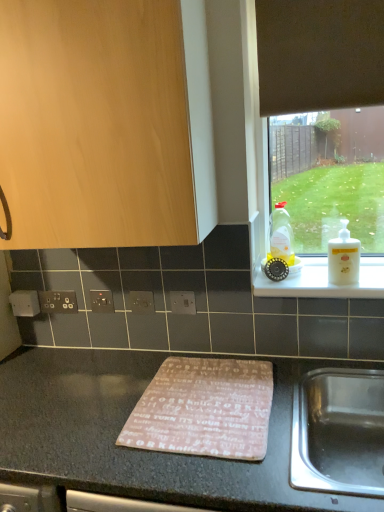
Find the location of a particular element. matte gray electric outlet at center, the 1th electric outlet viewed from the right is located at coordinates (183, 302).

I want to click on wooden cabinet at upper left, so click(106, 123).

What do you see at coordinates (281, 234) in the screenshot?
I see `translucent plastic bottle at right, which is the 2th bottle from front to back` at bounding box center [281, 234].

Where is `white glossy lotion at right, marked as the 1th bottle in a right-to-left arrangement`? white glossy lotion at right, marked as the 1th bottle in a right-to-left arrangement is located at coordinates pos(343,258).

Describe the element at coordinates (343, 258) in the screenshot. This screenshot has width=384, height=512. I see `white glossy lotion at right, acting as the second bottle starting from the back` at that location.

Identify the location of pink fabric mat at center. (204, 409).

Does pink fabric mat at center have a greater width compared to white plastic ledge at upper right?

Yes.

Is the position of pink fabric mat at center more distant than that of white plastic ledge at upper right?

No.

The width and height of the screenshot is (384, 512). I want to click on countertop that is below the translucent plastic bottle at right, which is the 1th bottle in back-to-front order (from the image's perspective), so click(134, 449).

Considering the sizes of granite gray cutting board at center and translucent plastic bottle at right, which is the 2th bottle from right to left, in the image, is granite gray cutting board at center wider or thinner than translucent plastic bottle at right, which is the 2th bottle from right to left,?

Considering their sizes, granite gray cutting board at center looks broader than translucent plastic bottle at right, which is the 2th bottle from right to left.

Based on the photo, can you see granite gray cutting board at center touching translucent plastic bottle at right, which is the 2th bottle from front to back?

There is a gap between granite gray cutting board at center and translucent plastic bottle at right, which is the 2th bottle from front to back.

From the image's perspective, is black plastic electric outlet at center, positioned as the third electric outlet in right-to-left order, on top of satin silver switch at center, which is counted as the third electric outlet, starting from the left?

No, from the image's perspective, black plastic electric outlet at center, positioned as the third electric outlet in right-to-left order, is not on top of satin silver switch at center, which is counted as the third electric outlet, starting from the left.

How many degrees apart are the facing directions of black plastic electric outlet at center, positioned as the second electric outlet in left-to-right order, and satin silver switch at center, which is counted as the third electric outlet, starting from the left?

0.0185 degrees.

Looking at their sizes, would you say black plastic electric outlet at center, positioned as the third electric outlet in right-to-left order, is wider or thinner than satin silver switch at center, acting as the 2th electric outlet starting from the right?

In the image, black plastic electric outlet at center, positioned as the third electric outlet in right-to-left order, appears to be wider than satin silver switch at center, acting as the 2th electric outlet starting from the right.

Who is smaller, granite gray cutting board at center or white plastic ledge at upper right?

white plastic ledge at upper right.

You are a GUI agent. You are given a task and a screenshot of the screen. Output one action in this format:
    pyautogui.click(x=<x>, y=<y>)
    Task: Click on the countertop below the white plastic ledge at upper right (from a real-world perspective)
    
    Given the screenshot: What is the action you would take?
    pyautogui.click(x=134, y=449)

Is granite gray cutting board at center shorter than white plastic ledge at upper right?

No, granite gray cutting board at center is not shorter than white plastic ledge at upper right.

Is matte gray electric outlet at center, acting as the 4th electric outlet starting from the left, thinner than granite gray cutting board at center?

Yes.

Is granite gray cutting board at center inside matte gray electric outlet at center, acting as the 4th electric outlet starting from the left?

No, granite gray cutting board at center is located outside of matte gray electric outlet at center, acting as the 4th electric outlet starting from the left.

How much distance is there between matte gray electric outlet at center, acting as the 4th electric outlet starting from the left, and granite gray cutting board at center?

A distance of 19.43 inches exists between matte gray electric outlet at center, acting as the 4th electric outlet starting from the left, and granite gray cutting board at center.

Is matte gray electric outlet at center, acting as the 4th electric outlet starting from the left, facing away from granite gray cutting board at center?

No, matte gray electric outlet at center, acting as the 4th electric outlet starting from the left,'s orientation is not away from granite gray cutting board at center.

Considering the sizes of objects translucent plastic bottle at right, which is the 2th bottle from front to back, and matte gray electric outlet at center, acting as the 4th electric outlet starting from the left, in the image provided, who is shorter, translucent plastic bottle at right, which is the 2th bottle from front to back, or matte gray electric outlet at center, acting as the 4th electric outlet starting from the left,?

With less height is matte gray electric outlet at center, acting as the 4th electric outlet starting from the left.

At what (x,y) coordinates should I click in order to perform the action: click on the 3rd electric outlet below the translucent plastic bottle at right, which is the 1th bottle in back-to-front order (from a real-world perspective). Please return your answer as a coordinate pair (x, y). This screenshot has height=512, width=384. Looking at the image, I should click on (183, 302).

From a real-world perspective, is translucent plastic bottle at right, which is the 2th bottle from right to left, positioned above or below matte gray electric outlet at center, the 1th electric outlet viewed from the right?

A: From a real-world perspective, translucent plastic bottle at right, which is the 2th bottle from right to left, is physically above matte gray electric outlet at center, the 1th electric outlet viewed from the right.

Is translucent plastic bottle at right, which is the 1th bottle in back-to-front order, thinner than matte gray electric outlet at center, acting as the 4th electric outlet starting from the left?

Incorrect, the width of translucent plastic bottle at right, which is the 1th bottle in back-to-front order, is not less than that of matte gray electric outlet at center, acting as the 4th electric outlet starting from the left.

Is black plastic electric outlet at center, positioned as the third electric outlet in right-to-left order, facing away from pink fabric mat at center?

No, black plastic electric outlet at center, positioned as the third electric outlet in right-to-left order, is not facing the opposite direction of pink fabric mat at center.

Which object is thinner, black plastic electric outlet at center, positioned as the third electric outlet in right-to-left order, or pink fabric mat at center?

black plastic electric outlet at center, positioned as the third electric outlet in right-to-left order, is thinner.

In the image, there is a black plastic electric outlet at center, positioned as the second electric outlet in left-to-right order. Find the location of `mat below it (from a real-world perspective)`. mat below it (from a real-world perspective) is located at coordinates (204, 409).

You are a GUI agent. You are given a task and a screenshot of the screen. Output one action in this format:
    pyautogui.click(x=<x>, y=<y>)
    Task: Click on the ledge on the right of pink fabric mat at center
    The image size is (384, 512).
    Given the screenshot: What is the action you would take?
    pyautogui.click(x=323, y=281)

Locate an element on the screen. The height and width of the screenshot is (512, 384). countertop located on the left of translucent plastic bottle at right, which is the 2th bottle from front to back is located at coordinates (134, 449).

Estimate the real-world distances between objects in this image. Which object is further from satin silver switch at center, which is counted as the third electric outlet, starting from the left, pink fabric mat at center or white glossy lotion at right, placed as the 1th bottle when sorted from front to back?

white glossy lotion at right, placed as the 1th bottle when sorted from front to back, is positioned further to the anchor satin silver switch at center, which is counted as the third electric outlet, starting from the left.

Considering their positions, is pink fabric mat at center positioned closer to black plastic electrical outlet at lower left, marked as the 1th electric outlet in a left-to-right arrangement, than white plastic ledge at upper right?

Among the two, pink fabric mat at center is located nearer to black plastic electrical outlet at lower left, marked as the 1th electric outlet in a left-to-right arrangement.

Estimate the real-world distances between objects in this image. Which object is further from granite gray cutting board at center, black plastic electrical outlet at lower left, marked as the 1th electric outlet in a left-to-right arrangement, or black plastic electric outlet at center, positioned as the second electric outlet in left-to-right order?

black plastic electrical outlet at lower left, marked as the 1th electric outlet in a left-to-right arrangement, lies further to granite gray cutting board at center than the other object.

Looking at the image, which one is located further to wooden cabinet at upper left, pink fabric mat at center or satin silver switch at center, acting as the 2th electric outlet starting from the right?

The object further to wooden cabinet at upper left is pink fabric mat at center.

Based on their spatial positions, is black plastic electrical outlet at lower left, the fourth electric outlet in the right-to-left sequence, or wooden cabinet at upper left further from white glossy lotion at right, acting as the second bottle starting from the back?

black plastic electrical outlet at lower left, the fourth electric outlet in the right-to-left sequence, lies further to white glossy lotion at right, acting as the second bottle starting from the back, than the other object.

Based on their spatial positions, is translucent plastic bottle at right, which is the 2th bottle from front to back, or white plastic ledge at upper right closer to granite gray cutting board at center?

The object closer to granite gray cutting board at center is white plastic ledge at upper right.

Based on their spatial positions, is matte gray electric outlet at center, acting as the 4th electric outlet starting from the left, or translucent plastic bottle at right, which is the 1th bottle in back-to-front order, closer to granite gray cutting board at center?

matte gray electric outlet at center, acting as the 4th electric outlet starting from the left, lies closer to granite gray cutting board at center than the other object.

Looking at the image, which one is located closer to black plastic electrical outlet at lower left, the fourth electric outlet in the right-to-left sequence, pink fabric mat at center or wooden cabinet at upper left?

pink fabric mat at center lies closer to black plastic electrical outlet at lower left, the fourth electric outlet in the right-to-left sequence, than the other object.

I want to click on electric outlet located between wooden cabinet at upper left and satin silver switch at center, acting as the 2th electric outlet starting from the right, in the depth direction, so tap(183, 302).

In order to click on ledge that lies between white glossy lotion at right, acting as the second bottle starting from the back, and granite gray cutting board at center from top to bottom in this screenshot , I will do `click(323, 281)`.

You are a GUI agent. You are given a task and a screenshot of the screen. Output one action in this format:
    pyautogui.click(x=<x>, y=<y>)
    Task: Click on the bottle located between black plastic electrical outlet at lower left, the fourth electric outlet in the right-to-left sequence, and white glossy lotion at right, placed as the 1th bottle when sorted from front to back, in the left-right direction
    The height and width of the screenshot is (512, 384).
    Given the screenshot: What is the action you would take?
    pyautogui.click(x=281, y=234)

At what (x,y) coordinates should I click in order to perform the action: click on ledge located between matte gray electric outlet at center, acting as the 4th electric outlet starting from the left, and white glossy lotion at right, acting as the 2th bottle starting from the left, in the left-right direction. Please return your answer as a coordinate pair (x, y). Image resolution: width=384 pixels, height=512 pixels. Looking at the image, I should click on (323, 281).